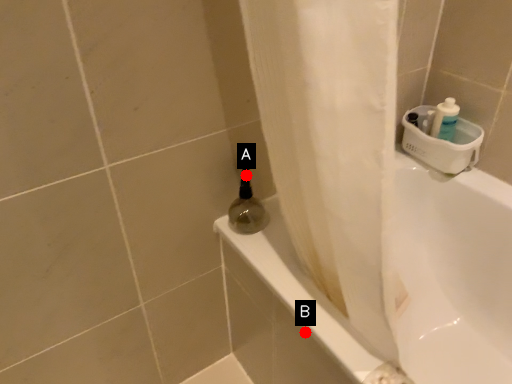
Question: Two points are circled on the image, labeled by A and B beside each circle. Which point is farther from the camera taking this photo?

Choices:
 (A) A is further
 (B) B is further

Answer: (A)